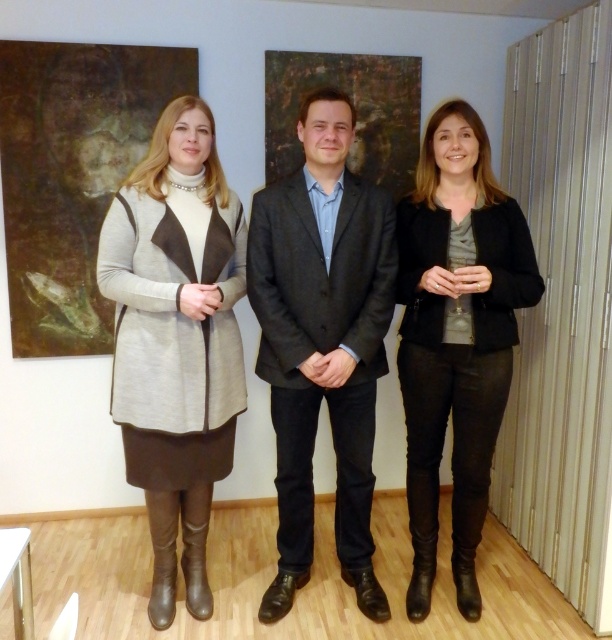
You are standing in the gallery and want to move from the point at coordinates point (165,291) to the point at coordinates point (483,388). Is the destination point behind or in front of your starting position?

Point (165,291) is in front of point (483,388), so the destination point is behind your starting position.